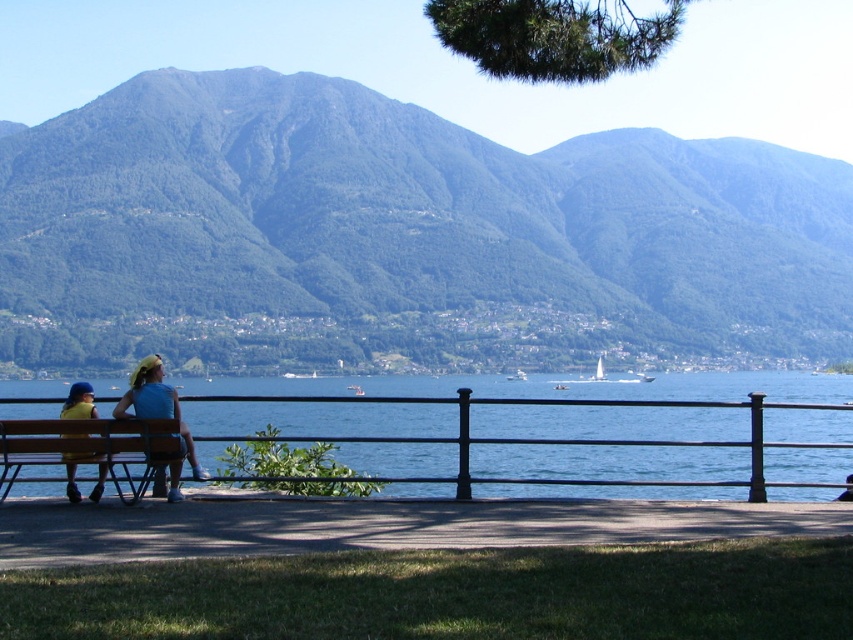
Question: Which point is closer to the camera?

Choices:
 (A) (329, 129)
 (B) (160, 385)

Answer: (B)

Question: Considering the relative positions of black metal fence at lower center and yellow fabric dress at left in the image provided, where is black metal fence at lower center located with respect to yellow fabric dress at left?

Choices:
 (A) left
 (B) right

Answer: (B)

Question: Does green forested mountain at upper center lie in front of yellow fabric dress at left?

Choices:
 (A) no
 (B) yes

Answer: (A)

Question: Can you confirm if green forested mountain at upper center is smaller than yellow fabric dress at left?

Choices:
 (A) no
 (B) yes

Answer: (A)

Question: Which object is positioned closest to the yellow fabric dress at left?

Choices:
 (A) yellow fabric bench at center
 (B) black metal fence at lower center
 (C) wooden bench at lower left

Answer: (C)

Question: Among these points, which one is farthest from the camera?

Choices:
 (A) (450, 387)
 (B) (151, 461)
 (C) (167, 397)
 (D) (24, 224)

Answer: (D)